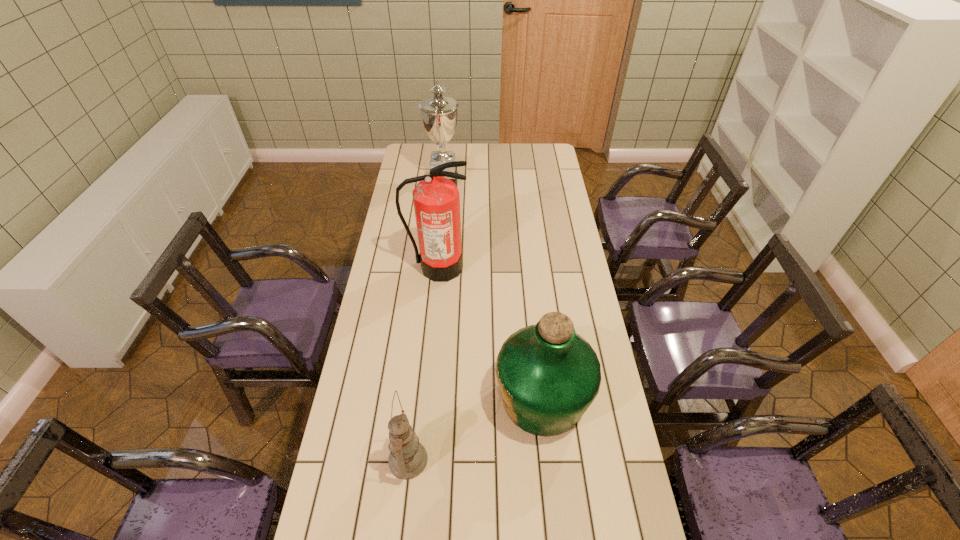
Identify the location of vacant space that satisfies the following two spatial constraints: 1. at the front view of the farthest object; 2. on the front side of the shortest object. The height and width of the screenshot is (540, 960). (416, 460).

Identify the location of free space that satisfies the following two spatial constraints: 1. at the front view of the trophy cup; 2. on the front side of the shortest object. (416, 460).